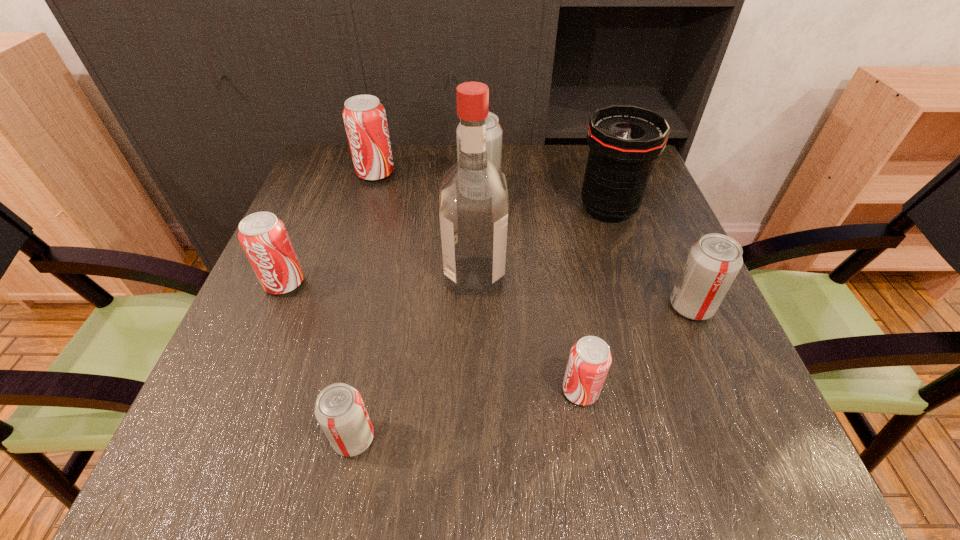
You are a GUI agent. You are given a task and a screenshot of the screen. Output one action in this format:
    pyautogui.click(x=<x>, y=<y>)
    Task: Click on the second nearest object
    This screenshot has width=960, height=540.
    Given the screenshot: What is the action you would take?
    pyautogui.click(x=590, y=358)

Where is `the third object from right to left`? This screenshot has width=960, height=540. the third object from right to left is located at coordinates (590, 358).

What are the coordinates of `the nearest object` in the screenshot? It's located at (340, 411).

You are a GUI agent. You are given a task and a screenshot of the screen. Output one action in this format:
    pyautogui.click(x=<x>, y=<y>)
    Task: Click on the third soda can from left to right
    Image resolution: width=960 pixels, height=540 pixels.
    Given the screenshot: What is the action you would take?
    pyautogui.click(x=340, y=411)

Where is `free space located on the front-facing side of the tallest object`? Image resolution: width=960 pixels, height=540 pixels. free space located on the front-facing side of the tallest object is located at coordinates (606, 275).

Identify the location of vacant space positioned 0.080m on the left of the telephoto lens. (542, 209).

Where is `free spot located on the logo side of the second red soda can from right to left`? The image size is (960, 540). free spot located on the logo side of the second red soda can from right to left is located at coordinates (504, 173).

The image size is (960, 540). I want to click on vacant space located 0.090m on the front of the biggest gray soda can, so click(x=479, y=228).

You are a GUI agent. You are given a task and a screenshot of the screen. Output one action in this format:
    pyautogui.click(x=<x>, y=<y>)
    Task: Click on the free space located on the back of the rightmost gray soda can
    
    Given the screenshot: What is the action you would take?
    pyautogui.click(x=667, y=253)

You are a GUI agent. You are given a task and a screenshot of the screen. Output one action in this format:
    pyautogui.click(x=<x>, y=<y>)
    Task: Click on the vacant space situated on the logo side of the second nearest red soda can
    
    Given the screenshot: What is the action you would take?
    pyautogui.click(x=217, y=443)